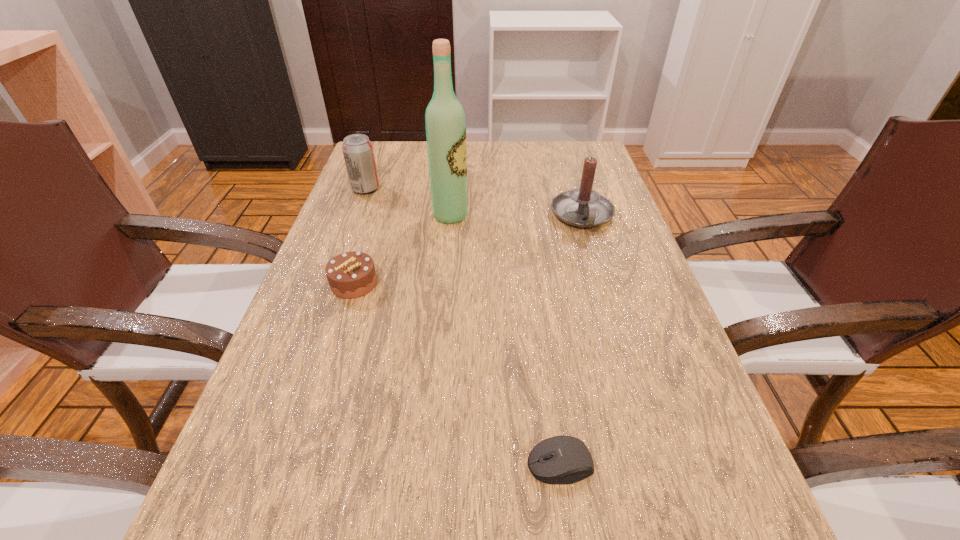
In the image, there is a desktop. At what (x,y) coordinates should I click in order to perform the action: click on vacant space at the far right corner. Please return your answer as a coordinate pair (x, y). Looking at the image, I should click on (550, 150).

In order to click on free spot between the tallest object and the rightmost object in this screenshot , I will do `click(516, 216)`.

Where is `unoccupied position between the third object from left to right and the soda can`? unoccupied position between the third object from left to right and the soda can is located at coordinates (408, 202).

This screenshot has height=540, width=960. I want to click on free spot between the shortest object and the rightmost object, so click(571, 340).

You are a GUI agent. You are given a task and a screenshot of the screen. Output one action in this format:
    pyautogui.click(x=<x>, y=<y>)
    Task: Click on the empty location between the candle and the fourth farthest object
    This screenshot has width=960, height=540.
    Given the screenshot: What is the action you would take?
    pyautogui.click(x=468, y=249)

Locate an element on the screen. Image resolution: width=960 pixels, height=540 pixels. vacant space that is in between the nearest object and the wine bottle is located at coordinates (505, 340).

Locate an element on the screen. The image size is (960, 540). vacant area that lies between the rightmost object and the wine bottle is located at coordinates (516, 216).

This screenshot has width=960, height=540. I want to click on empty location between the rightmost object and the second nearest object, so click(468, 249).

You are a GUI agent. You are given a task and a screenshot of the screen. Output one action in this format:
    pyautogui.click(x=<x>, y=<y>)
    Task: Click on the vacant area between the second nearest object and the shortest object
    This screenshot has width=960, height=540.
    Given the screenshot: What is the action you would take?
    pyautogui.click(x=457, y=374)

Locate an element on the screen. This screenshot has width=960, height=540. vacant region between the farthest object and the candle is located at coordinates (474, 202).